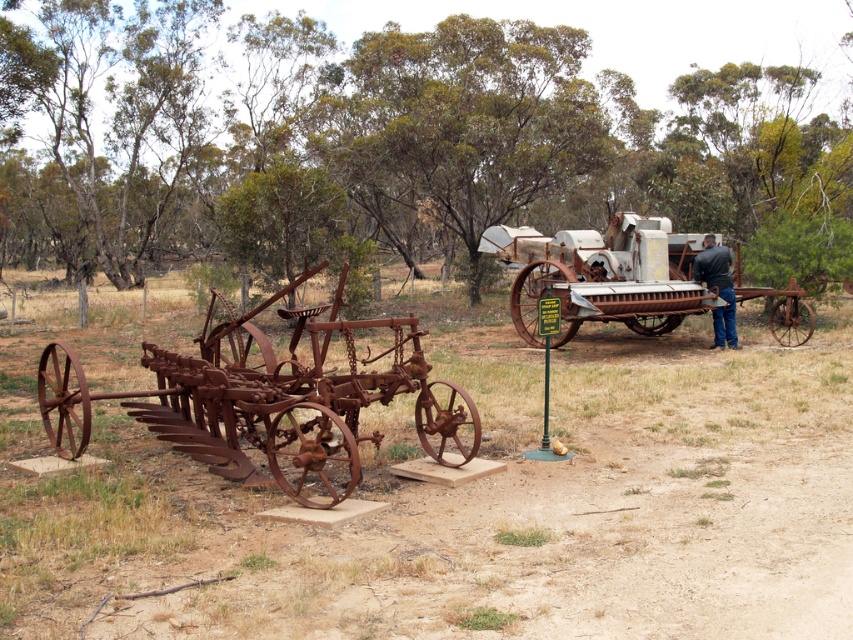
Question: Where is rusty metal tractor at center located in relation to dark blue jeans at center in the image?

Choices:
 (A) below
 (B) above

Answer: (A)

Question: Is rusty metal tractor at left smaller than rusty metal tractor at center?

Choices:
 (A) no
 (B) yes

Answer: (B)

Question: Is rusty metal plow at left above rusty metal tractor at left?

Choices:
 (A) yes
 (B) no

Answer: (A)

Question: Estimate the real-world distances between objects in this image. Which object is closer to the dark blue jeans at center?

Choices:
 (A) rusty metal plow at left
 (B) rusty metal tractor at center
 (C) rusty metal tractor at left

Answer: (B)

Question: Which object is farther from the camera taking this photo?

Choices:
 (A) dark blue jeans at center
 (B) rusty metal tractor at left
 (C) rusty metal plow at left
 (D) rusty metal tractor at center

Answer: (A)

Question: Which object appears closest to the camera in this image?

Choices:
 (A) rusty metal tractor at center
 (B) rusty metal plow at left
 (C) rusty metal tractor at left

Answer: (B)